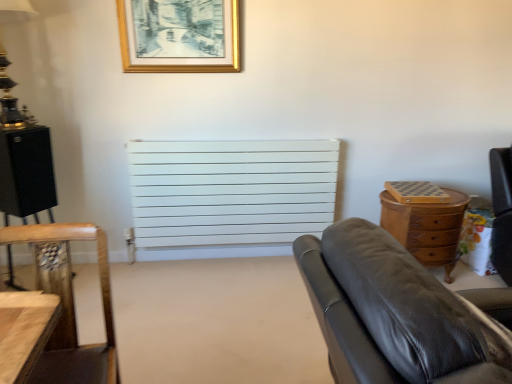
Question: Does gold metallic lamp at upper left touch gold/golden frame at upper center?

Choices:
 (A) yes
 (B) no

Answer: (B)

Question: From the image's perspective, would you say gold metallic lamp at upper left is shown under gold/golden frame at upper center?

Choices:
 (A) no
 (B) yes

Answer: (B)

Question: From the image's perspective, is gold metallic lamp at upper left over gold/golden frame at upper center?

Choices:
 (A) yes
 (B) no

Answer: (B)

Question: Does gold metallic lamp at upper left have a smaller size compared to gold/golden frame at upper center?

Choices:
 (A) yes
 (B) no

Answer: (B)

Question: Can you confirm if gold metallic lamp at upper left is wider than gold/golden frame at upper center?

Choices:
 (A) yes
 (B) no

Answer: (A)

Question: Does gold metallic lamp at upper left have a lesser height compared to gold/golden frame at upper center?

Choices:
 (A) no
 (B) yes

Answer: (A)

Question: Is white matte radiator at center oriented away from gold metallic lamp at upper left?

Choices:
 (A) yes
 (B) no

Answer: (B)

Question: Does white matte radiator at center have a smaller size compared to gold metallic lamp at upper left?

Choices:
 (A) no
 (B) yes

Answer: (A)

Question: From a real-world perspective, is white matte radiator at center physically below gold metallic lamp at upper left?

Choices:
 (A) yes
 (B) no

Answer: (A)

Question: Can you confirm if white matte radiator at center is taller than gold metallic lamp at upper left?

Choices:
 (A) yes
 (B) no

Answer: (A)

Question: From a real-world perspective, is white matte radiator at center over gold metallic lamp at upper left?

Choices:
 (A) yes
 (B) no

Answer: (B)

Question: From the image's perspective, is white matte radiator at center above gold metallic lamp at upper left?

Choices:
 (A) yes
 (B) no

Answer: (B)

Question: Considering the relative sizes of gold metallic lamp at upper left and white matte radiator at center in the image provided, is gold metallic lamp at upper left smaller than white matte radiator at center?

Choices:
 (A) yes
 (B) no

Answer: (A)